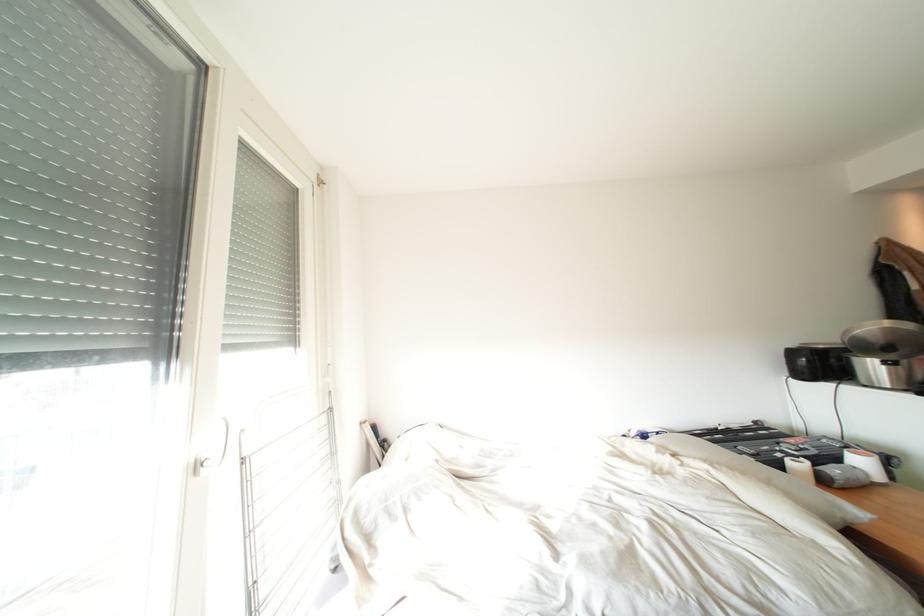
Identify the location of white door handle. (225, 445).